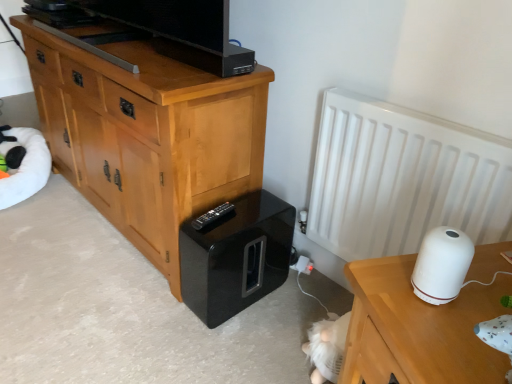
Identify the location of vacant area that lies in front of light brown wood chest of drawers at left. (102, 299).